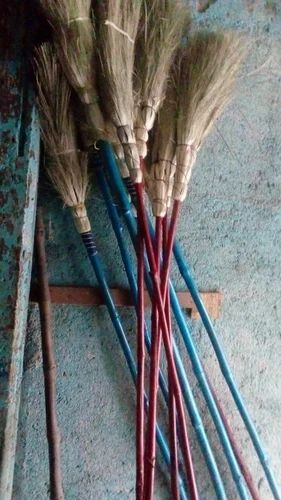
Find the location of `broom`. broom is located at coordinates (82, 47).